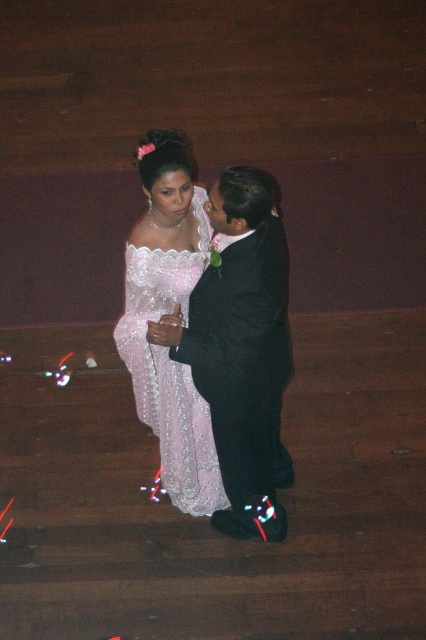
Does point (218, 186) lie in front of point (149, 259)?

Yes, point (218, 186) is closer to viewer.

In the scene shown: Is shiny black suit at center to the left of matte lace dress at center from the viewer's perspective?

No, shiny black suit at center is not to the left of matte lace dress at center.

This screenshot has height=640, width=426. I want to click on shiny black suit at center, so click(241, 349).